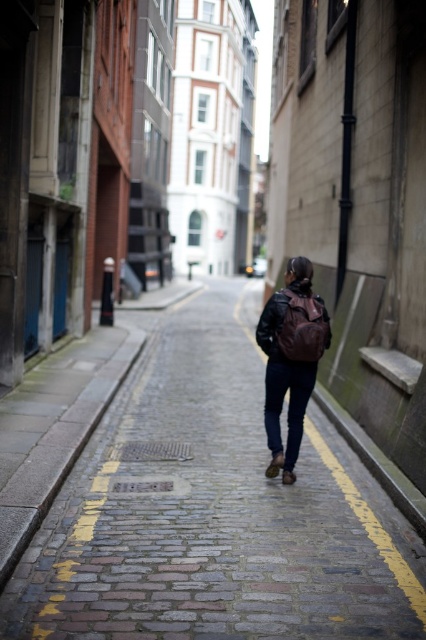
You are a delivery person carrying a matte brown backpack at center and a leather jacket at center. You need to place both items on the ground in the alley. Since the alley is narrow, you want to arrange them side by side without overlapping. Based on their current positions, which item should you move to the right to make space?

You should move the leather jacket at center to the right because the matte brown backpack at center is already to the left of it, so shifting the jacket to the right will allow both items to be placed side by side without overlapping.

You are a delivery person carrying a package and need to walk through the alley. You see the cobblestone pavement at center and the leather jacket at center. Which object should you step on to stay on the correct path?

The cobblestone pavement at center is the correct path, so you should step on the cobblestone pavement at center instead of the leather jacket at center.